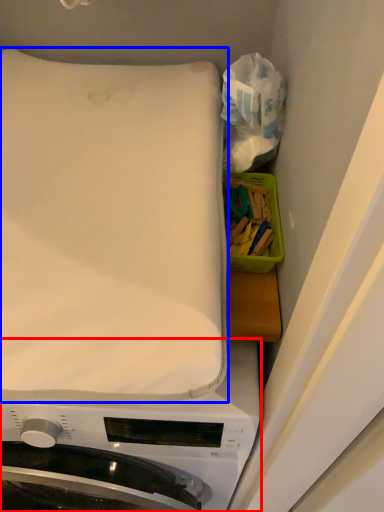
Question: Which point is further to the camera, washing machine (highlighted by a red box) or mattress (highlighted by a blue box)?

Choices:
 (A) washing machine
 (B) mattress

Answer: (A)